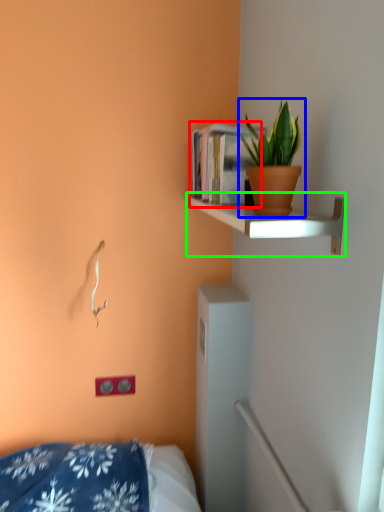
Question: Based on their relative distances, which object is nearer to book (highlighted by a red box)? Choose from houseplant (highlighted by a blue box) and shelf (highlighted by a green box).

Choices:
 (A) houseplant
 (B) shelf

Answer: (B)